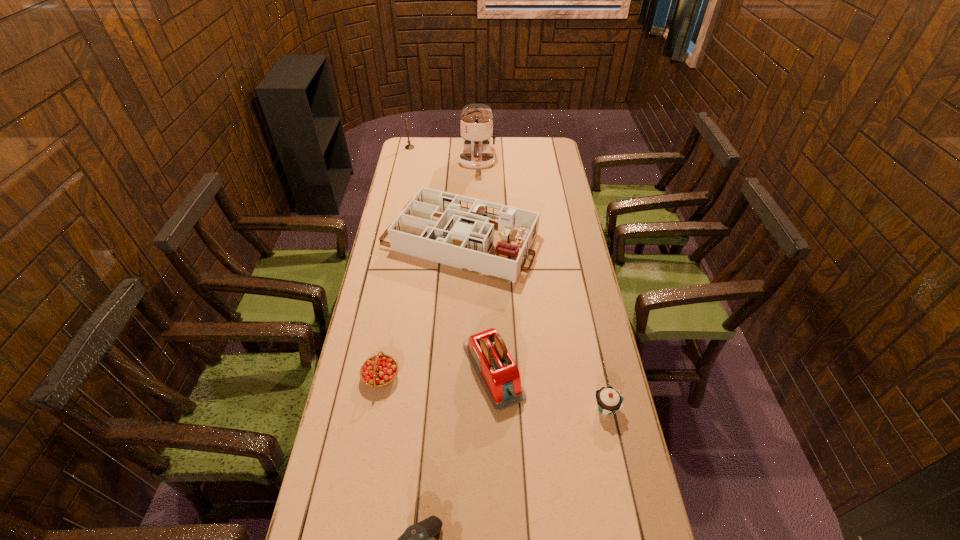
Find the location of a particular element. The image size is (960, 540). object that is at the far left corner is located at coordinates (409, 146).

The width and height of the screenshot is (960, 540). I want to click on free region at the far edge of the desktop, so click(x=499, y=146).

What are the coordinates of `free space at the left edge of the desktop` in the screenshot? It's located at (393, 222).

Identify the location of vacant region at the right edge. (550, 184).

In the image, there is a desktop. Identify the location of free region at the far left corner. (420, 146).

The height and width of the screenshot is (540, 960). In order to click on blank area at the far right corner in this screenshot , I will do `click(559, 159)`.

The height and width of the screenshot is (540, 960). In order to click on vacant space that is in between the rightmost object and the toaster in this screenshot , I will do `click(549, 389)`.

The image size is (960, 540). Identify the location of blank region between the coffee maker and the rightmost object. (541, 285).

The width and height of the screenshot is (960, 540). What are the coordinates of `empty space that is in between the toaster and the fifth nearest object` in the screenshot? It's located at (476, 306).

Locate an element on the screen. The width and height of the screenshot is (960, 540). empty space that is in between the dollhouse and the toaster is located at coordinates (476, 306).